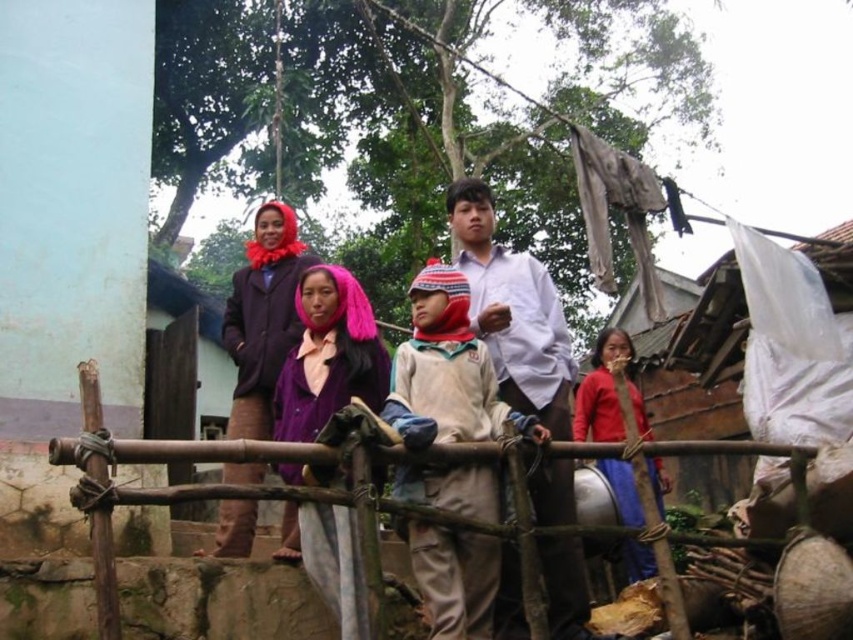
Can you confirm if purple fabric headscarf at center is positioned above purple woolen scarf at center?

Yes.

Measure the distance between point (550, 305) and camera.

Point (550, 305) and camera are 11.66 meters apart from each other.

Is point (512, 317) positioned before point (376, 397)?

No, (512, 317) is behind (376, 397).

The height and width of the screenshot is (640, 853). I want to click on purple fabric headscarf at center, so click(x=514, y=312).

Can you confirm if knitted woolen hat at center is positioned to the right of white cotton shirt at center?

In fact, knitted woolen hat at center is to the left of white cotton shirt at center.

Between knitted woolen hat at center and white cotton shirt at center, which one has less height?

knitted woolen hat at center is shorter.

Which is behind, point (469, 387) or point (572, 376)?

The point (572, 376) is behind.

The height and width of the screenshot is (640, 853). Find the location of `knitted woolen hat at center`. knitted woolen hat at center is located at coordinates (445, 371).

Which is more to the right, purple fabric headscarf at center or white cotton shirt at center?

purple fabric headscarf at center is more to the right.

Is purple fabric headscarf at center to the left of white cotton shirt at center from the viewer's perspective?

In fact, purple fabric headscarf at center is to the right of white cotton shirt at center.

Which is in front, point (479, 237) or point (550, 481)?

Positioned in front is point (550, 481).

The height and width of the screenshot is (640, 853). In order to click on purple fabric headscarf at center in this screenshot , I will do `click(514, 312)`.